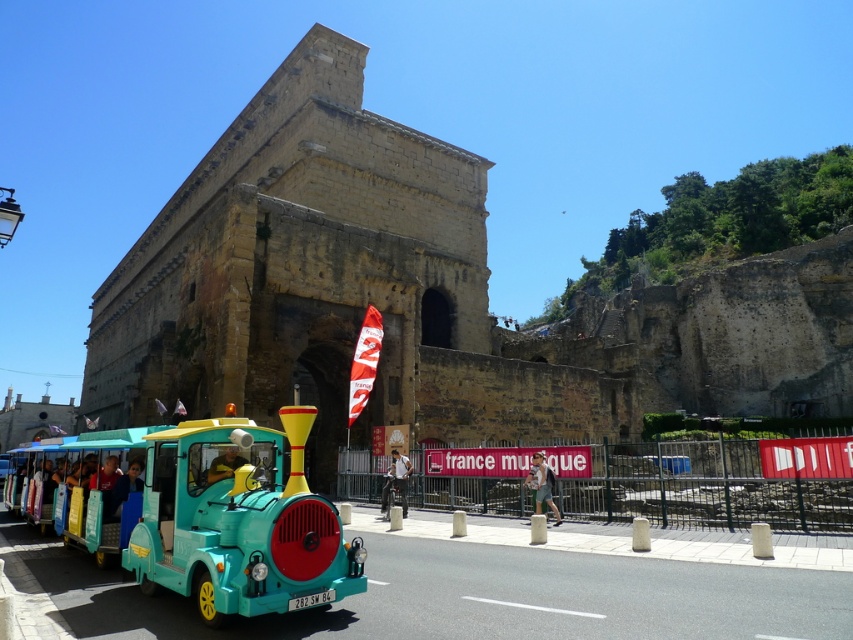
You are planning to take a photo of the historic stone arch while standing near the light blue fabric bicycle at center. To ensure the arch is fully visible in your photo, should you position yourself to the left or right of the bicycle?

The light blue fabric bicycle at center is located at point (x=396, y=481), so positioning yourself to the right of the bicycle would keep the arch fully visible in the photo.

Consider the image. What is located at the point with coordinates (541, 484) in the image?

The green fabric shirt at center is located at point (541, 484).